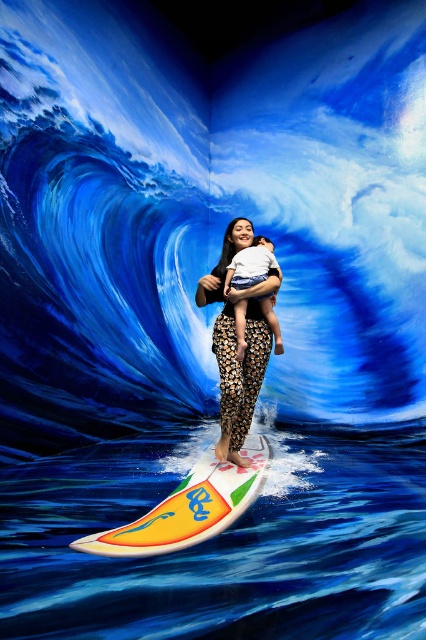
Which is behind, point (74, 541) or point (238, 337)?

Point (238, 337)

Between point (157, 538) and point (265, 237), which one is positioned behind?

Point (265, 237)

Identify the location of yellow-green plastic surfboard at center. This screenshot has height=640, width=426. (189, 506).

Can you confirm if yellow-green plastic surfboard at center is positioned below leopard print pants at center?

Yes.

Between yellow-green plastic surfboard at center and leopard print pants at center, which one is positioned lower?

Positioned lower is yellow-green plastic surfboard at center.

Between point (164, 508) and point (253, 404), which one is positioned in front?

Positioned in front is point (164, 508).

I want to click on yellow-green plastic surfboard at center, so click(189, 506).

Is leopard print pants at center below white cotton shirt at center?

Yes.

Is leopard print pants at center to the left of white cotton shirt at center from the viewer's perspective?

Indeed, leopard print pants at center is positioned on the left side of white cotton shirt at center.

Describe the element at coordinates (236, 342) in the screenshot. I see `leopard print pants at center` at that location.

Image resolution: width=426 pixels, height=640 pixels. I want to click on leopard print pants at center, so click(236, 342).